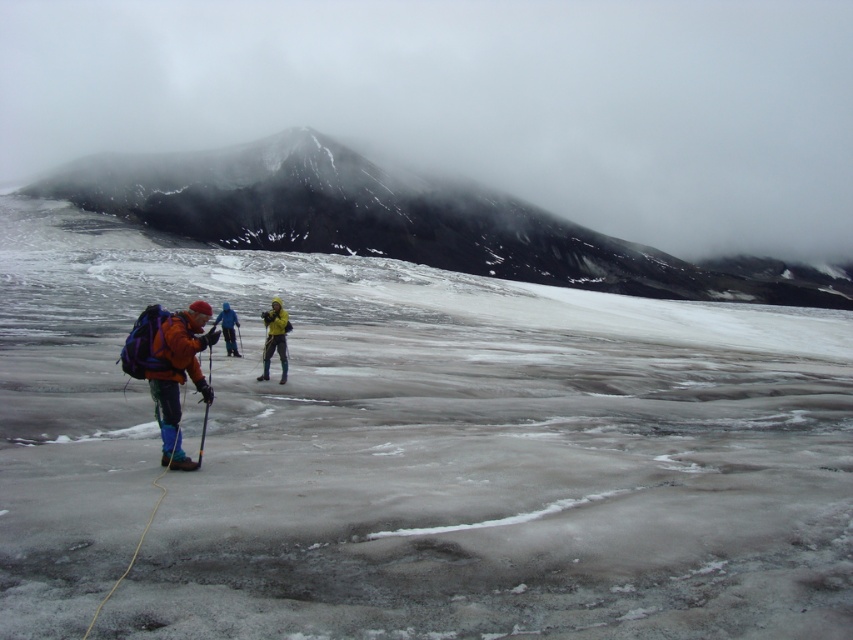
Question: Which object is the farthest from the yellow fabric jacket at center?

Choices:
 (A) orange fleece jacket at center
 (B) orange fleece jacket at left

Answer: (B)

Question: In this image, where is snowy rocky mountain at upper center located relative to orange fleece jacket at center?

Choices:
 (A) right
 (B) left

Answer: (A)

Question: Estimate the real-world distances between objects in this image. Which object is farther from the yellow fabric jacket at center?

Choices:
 (A) snowy rocky mountain at upper center
 (B) orange fleece jacket at left

Answer: (A)

Question: Which object is closer to the camera taking this photo?

Choices:
 (A) orange fleece jacket at center
 (B) yellow fabric jacket at center

Answer: (A)

Question: Is snowy rocky mountain at upper center bigger than orange fleece jacket at center?

Choices:
 (A) yes
 (B) no

Answer: (A)

Question: Is snowy rocky mountain at upper center to the left of orange fleece jacket at left from the viewer's perspective?

Choices:
 (A) yes
 (B) no

Answer: (B)